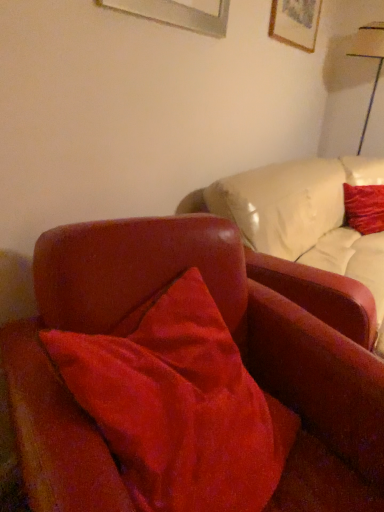
Question: Considering the relative positions of velvet red pillow at upper right and white glossy table lamp at upper right in the image provided, is velvet red pillow at upper right behind white glossy table lamp at upper right?

Choices:
 (A) yes
 (B) no

Answer: (B)

Question: Is velvet red pillow at upper right facing towards white glossy table lamp at upper right?

Choices:
 (A) yes
 (B) no

Answer: (B)

Question: Is velvet red pillow at upper right not near white glossy table lamp at upper right?

Choices:
 (A) yes
 (B) no

Answer: (A)

Question: Does velvet red pillow at upper right appear on the right side of white glossy table lamp at upper right?

Choices:
 (A) yes
 (B) no

Answer: (B)

Question: From a real-world perspective, is velvet red pillow at upper right located higher than white glossy table lamp at upper right?

Choices:
 (A) no
 (B) yes

Answer: (A)

Question: Considering the positions of point (375, 48) and point (345, 210), is point (375, 48) closer or farther from the camera than point (345, 210)?

Choices:
 (A) closer
 (B) farther

Answer: (B)

Question: Do you think white glossy table lamp at upper right is within velvet red pillow at upper right, or outside of it?

Choices:
 (A) inside
 (B) outside

Answer: (B)

Question: Relative to velvet red pillow at upper right, is white glossy table lamp at upper right in front or behind?

Choices:
 (A) front
 (B) behind

Answer: (B)

Question: In the image, is white glossy table lamp at upper right on the left side or the right side of velvet red pillow at upper right?

Choices:
 (A) left
 (B) right

Answer: (B)

Question: Is velvet red pillow at upper right spatially inside white glossy table lamp at upper right, or outside of it?

Choices:
 (A) inside
 (B) outside

Answer: (B)

Question: From a real-world perspective, is velvet red pillow at upper right above or below white glossy table lamp at upper right?

Choices:
 (A) below
 (B) above

Answer: (A)

Question: In terms of height, does velvet red pillow at upper right look taller or shorter compared to white glossy table lamp at upper right?

Choices:
 (A) short
 (B) tall

Answer: (A)

Question: Is velvet red pillow at upper right wider or thinner than white glossy table lamp at upper right?

Choices:
 (A) thin
 (B) wide

Answer: (A)

Question: In the image, is velvet red pillow at upper right positioned in front of or behind velvet red chair at center?

Choices:
 (A) behind
 (B) front

Answer: (A)

Question: From the image's perspective, is velvet red pillow at upper right above or below velvet red chair at center?

Choices:
 (A) above
 (B) below

Answer: (A)